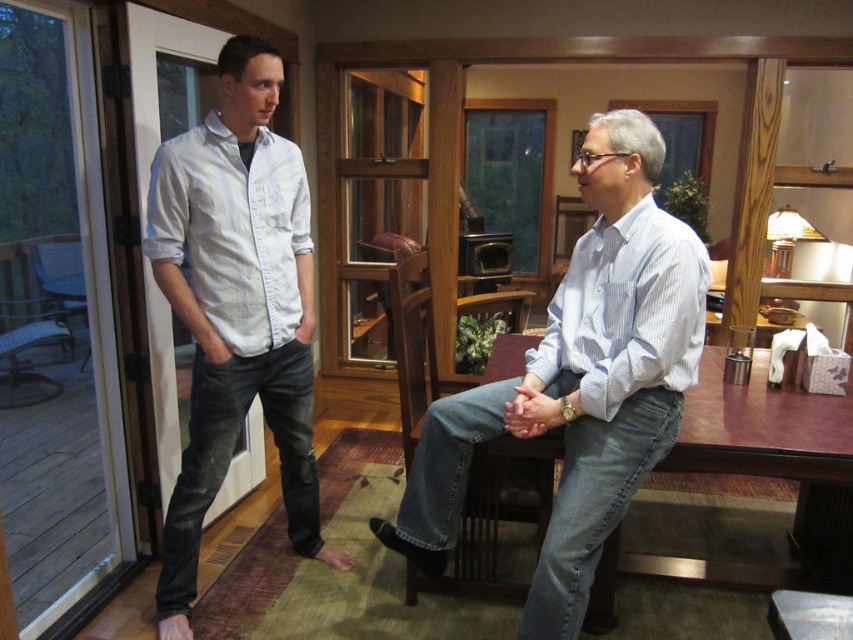
Question: Can you confirm if light blue striped shirt at center is positioned below light blue denim jeans at left?

Choices:
 (A) no
 (B) yes

Answer: (B)

Question: Which object appears closest to the camera in this image?

Choices:
 (A) light blue striped shirt at center
 (B) light blue denim jeans at left

Answer: (A)

Question: From the image, what is the correct spatial relationship of light blue striped shirt at center in relation to light blue denim jeans at left?

Choices:
 (A) left
 (B) right

Answer: (B)

Question: Can you confirm if light blue striped shirt at center is positioned to the left of light blue denim jeans at left?

Choices:
 (A) no
 (B) yes

Answer: (A)

Question: Among these points, which one is nearest to the camera?

Choices:
 (A) (579, 291)
 (B) (158, 220)

Answer: (A)